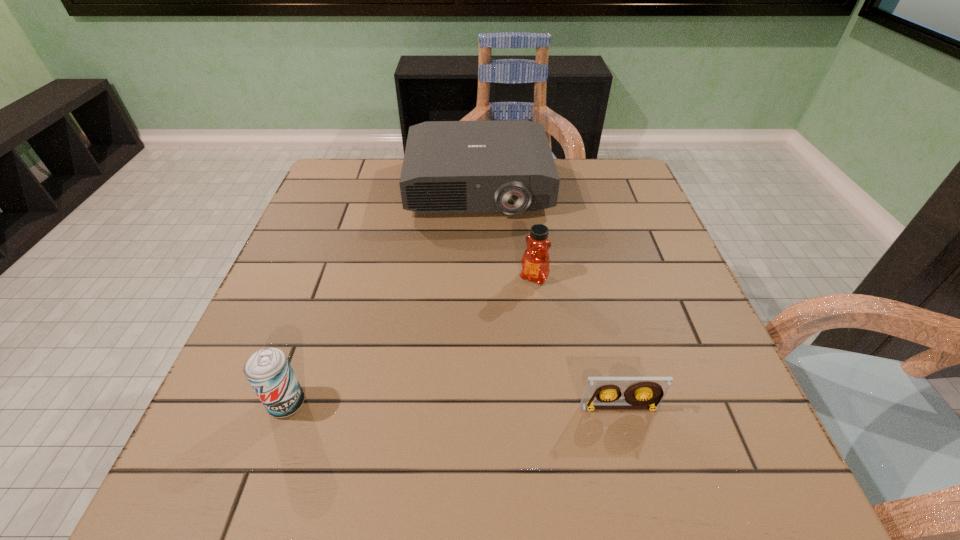
Where is `vacant space located 0.350m on the front label of the honey`? This screenshot has width=960, height=540. vacant space located 0.350m on the front label of the honey is located at coordinates (448, 416).

Where is `object situated at the far edge`? object situated at the far edge is located at coordinates (507, 166).

Locate an element on the screen. beer can located in the near edge section of the desktop is located at coordinates (268, 371).

This screenshot has width=960, height=540. In order to click on videotape at the near edge in this screenshot , I will do `click(601, 393)`.

You are a GUI agent. You are given a task and a screenshot of the screen. Output one action in this format:
    pyautogui.click(x=<x>, y=<y>)
    Task: Click on the object located at the left edge
    This screenshot has height=540, width=960.
    Given the screenshot: What is the action you would take?
    pyautogui.click(x=268, y=371)

The image size is (960, 540). What are the coordinates of `object that is at the right edge` in the screenshot? It's located at (601, 393).

I want to click on object positioned at the near left corner, so click(268, 371).

What are the coordinates of `object that is positioned at the near right corner` in the screenshot? It's located at (601, 393).

Where is `free region at the near edge of the desktop`? The width and height of the screenshot is (960, 540). free region at the near edge of the desktop is located at coordinates (334, 423).

In the image, there is a desktop. Find the location of `vacant space at the left edge`. vacant space at the left edge is located at coordinates (297, 255).